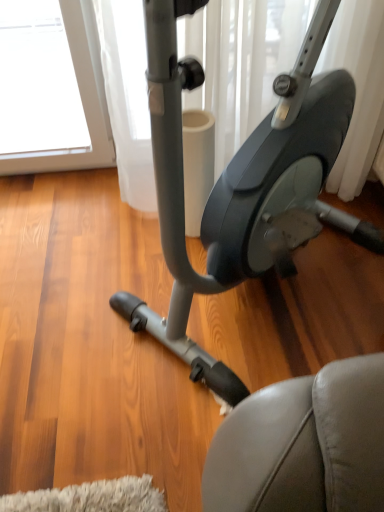
In order to face matte black stationary bicycle at center, should I rotate leftwards or rightwards?

To align with it, rotate right about 8.352°.

In order to click on matte black stationary bicycle at center in this screenshot , I will do `click(242, 184)`.

What do you see at coordinates (242, 184) in the screenshot? The image size is (384, 512). I see `matte black stationary bicycle at center` at bounding box center [242, 184].

In order to click on matte black stationary bicycle at center in this screenshot , I will do `click(242, 184)`.